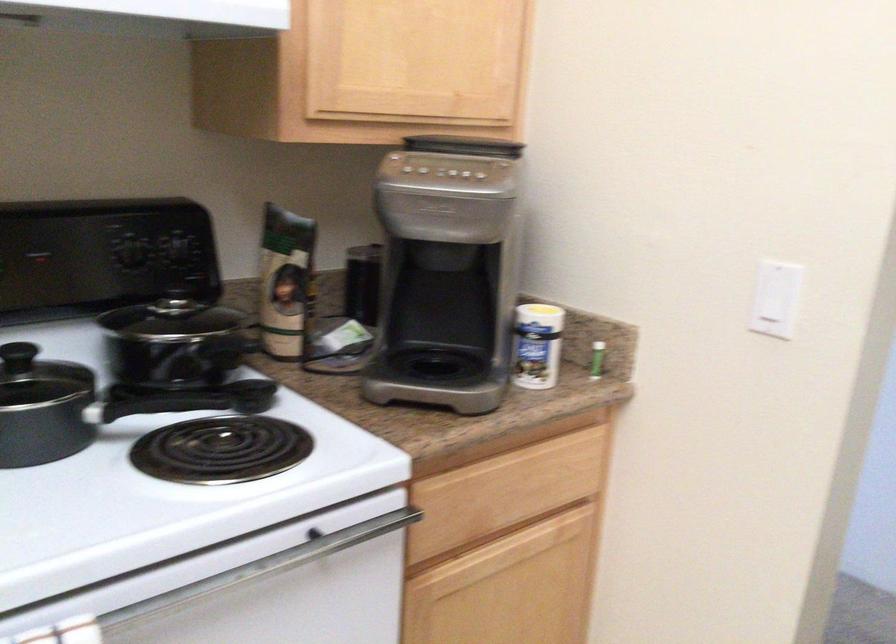
Image resolution: width=896 pixels, height=644 pixels. I want to click on black appliance dials, so click(x=130, y=247).